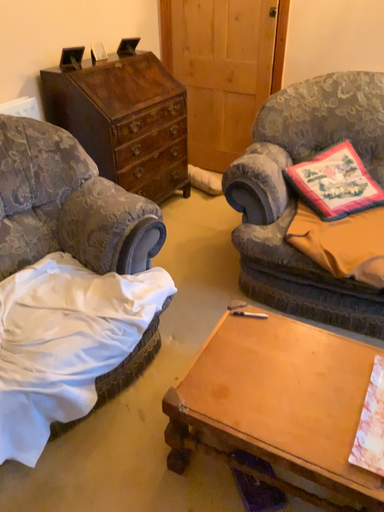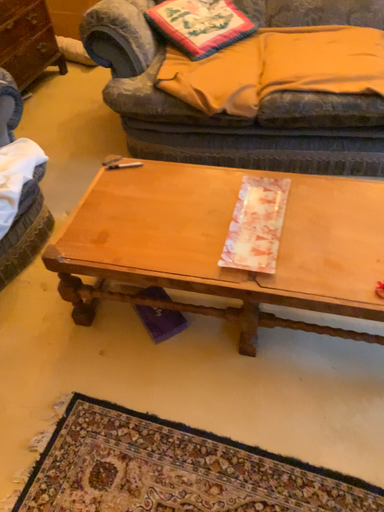
Question: Which way did the camera rotate in the video?

Choices:
 (A) rotated right
 (B) rotated left

Answer: (A)